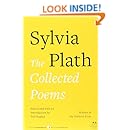
The image size is (130, 130). I want to click on book, so click(82, 107).